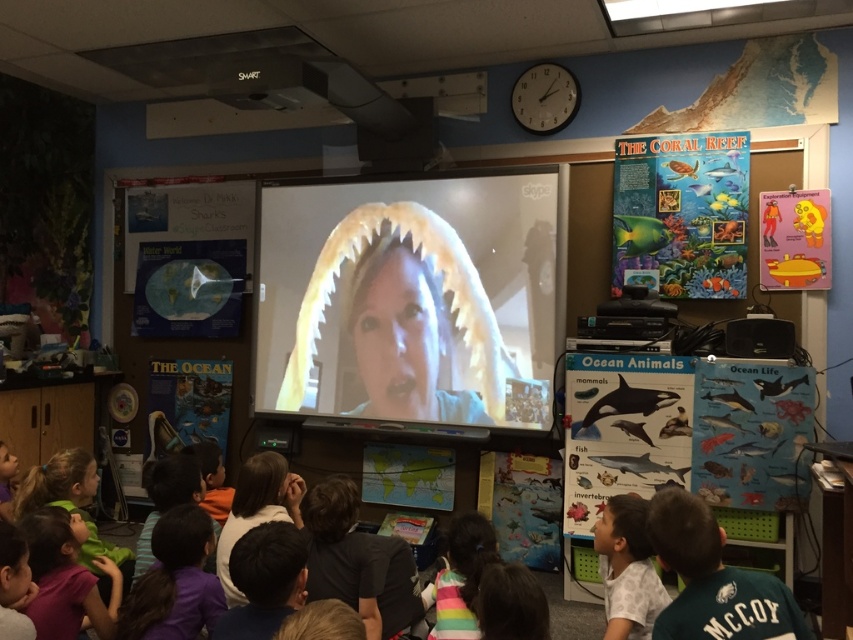
Question: Is green jersey at lower right to the right of white matte shirt at lower right from the viewer's perspective?

Choices:
 (A) no
 (B) yes

Answer: (B)

Question: Which point is closer to the camera?

Choices:
 (A) dark brown hair at lower left
 (B) white matte shirt at lower right

Answer: (B)

Question: Is green jersey at lower right behind rainbow striped shirt at lower center?

Choices:
 (A) no
 (B) yes

Answer: (A)

Question: Considering the real-world distances, which object is farthest from the matte plastic screen at center?

Choices:
 (A) rainbow striped shirt at lower center
 (B) dark brown hair at lower left
 (C) white matte shirt at lower right
 (D) green jersey at lower right

Answer: (D)

Question: Considering the real-world distances, which object is farthest from the rainbow striped shirt at lower center?

Choices:
 (A) dark brown hair at lower left
 (B) matte plastic screen at center
 (C) white matte shirt at lower right

Answer: (B)

Question: Does green jersey at lower right have a larger size compared to rainbow striped shirt at lower center?

Choices:
 (A) yes
 (B) no

Answer: (B)